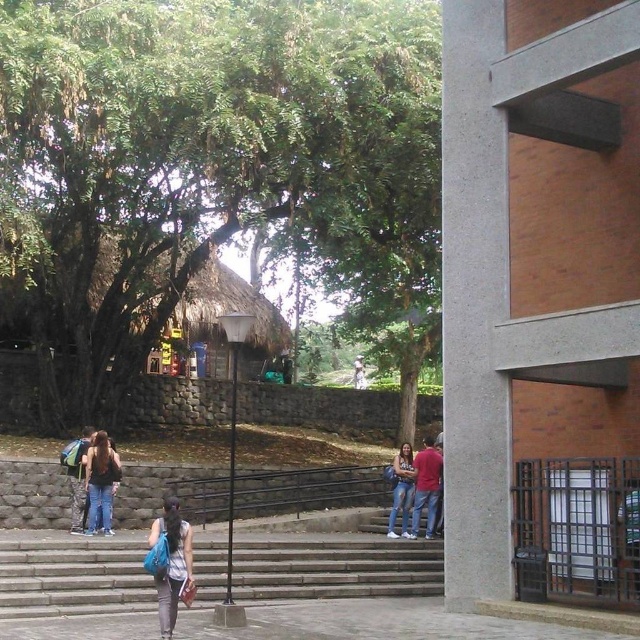
Question: Which of these objects is positioned closest to the denim jeans at center?

Choices:
 (A) thatched roof hut at center
 (B) denim jacket at lower left
 (C) light gray fabric backpack at lower center

Answer: (B)

Question: Which point is closer to the camera taking this photo?

Choices:
 (A) (362, 384)
 (B) (74, 492)
 (C) (504, 58)
 (D) (108, 518)

Answer: (C)

Question: Can you confirm if matte blue backpack at lower left is positioned to the left of denim jeans at center?

Choices:
 (A) no
 (B) yes

Answer: (B)

Question: Is gray concrete stairs at center smaller than matte red shirt at center?

Choices:
 (A) yes
 (B) no

Answer: (A)

Question: Can you confirm if light gray fabric backpack at lower center is wider than denim jacket at lower left?

Choices:
 (A) no
 (B) yes

Answer: (B)

Question: Which of the following is the farthest from the observer?

Choices:
 (A) (440, 472)
 (B) (362, 362)
 (C) (182, 540)
 (D) (118, 282)

Answer: (B)